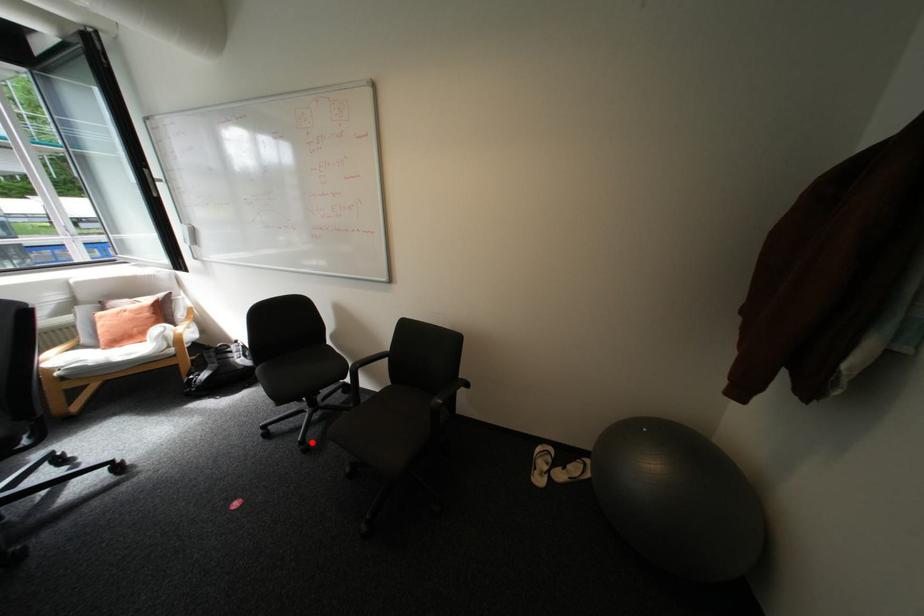
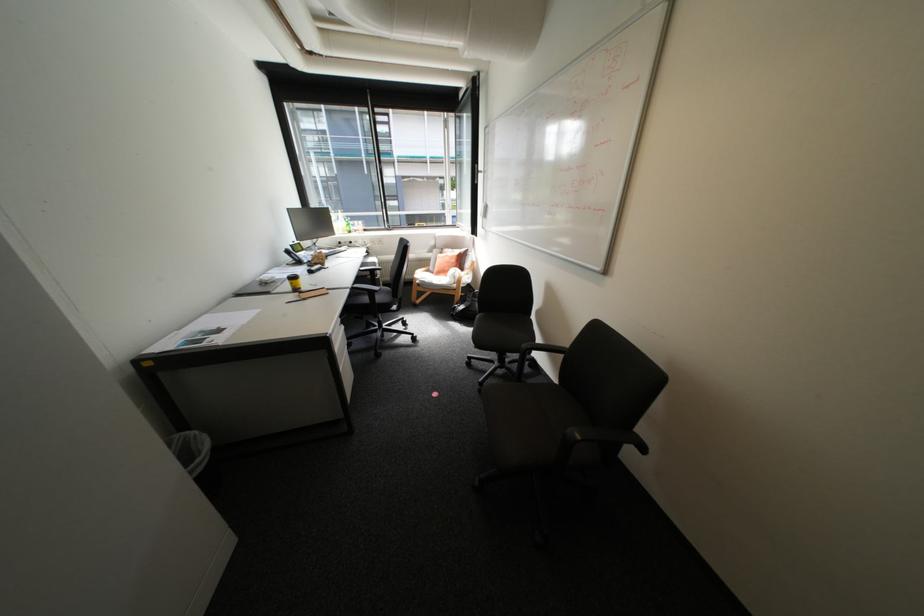
Question: I am providing you with two images of the same scene from different viewpoints. In image1, a red point is highlighted. Considering the same 3D point in image2, which of the following is correct?

Choices:
 (A) It is closer
 (B) It is farther

Answer: (A)